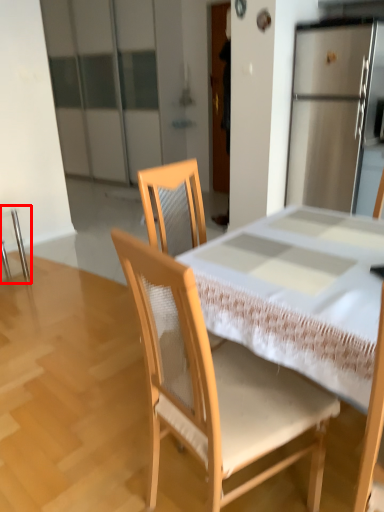
Question: From the image's perspective, where is chair (annotated by the red box) located relative to chair?

Choices:
 (A) above
 (B) below

Answer: (A)